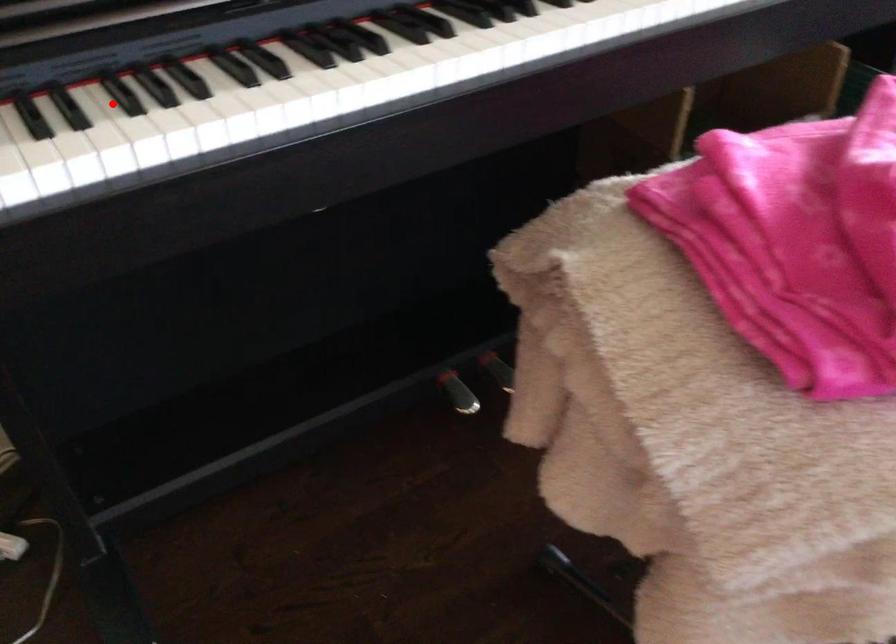
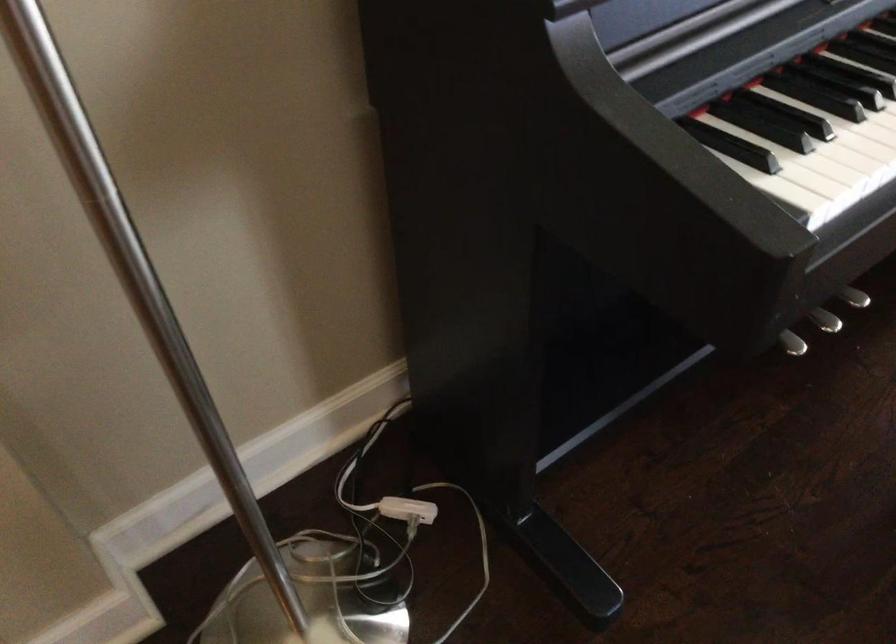
Find the pixel in the second image that matches the highlighted location in the first image.

(799, 100)